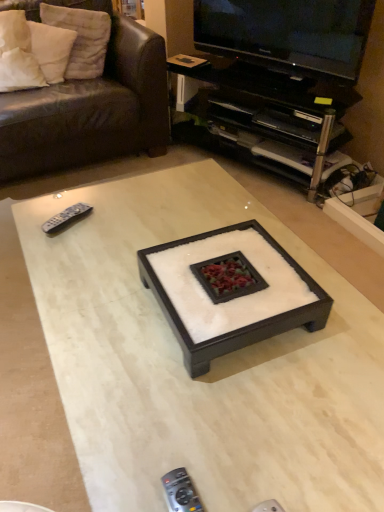
Where is `free space between gray plastic remote at left, marked as the first remote control in a back-to-front arrangement, and black plastic remote control at lower center, placed as the 1th remote control when sorted from front to back`? free space between gray plastic remote at left, marked as the first remote control in a back-to-front arrangement, and black plastic remote control at lower center, placed as the 1th remote control when sorted from front to back is located at coordinates (109, 321).